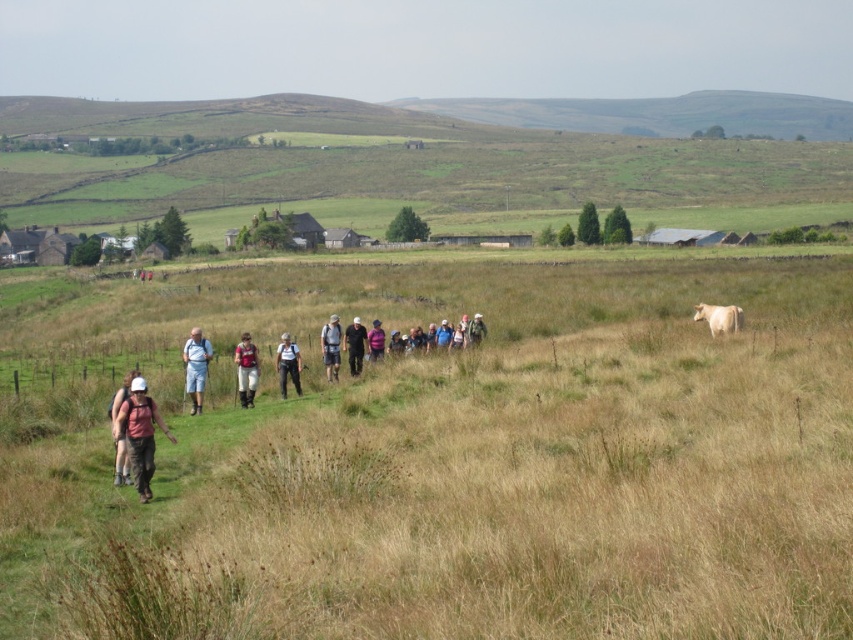
Is point (0, 560) closer to camera compared to point (346, 336)?

That is True.

Who is shorter, dry grass at center or dark gray fabric jacket at center?

dark gray fabric jacket at center is shorter.

The width and height of the screenshot is (853, 640). Identify the location of dry grass at center. (445, 456).

The image size is (853, 640). Find the location of `dry grass at center`. dry grass at center is located at coordinates (445, 456).

In the scene shown: Does dry grass at center have a larger size compared to camouflage fabric backpack at lower left?

Indeed, dry grass at center has a larger size compared to camouflage fabric backpack at lower left.

Which is behind, point (486, 493) or point (132, 432)?

The point (132, 432) is more distant.

The height and width of the screenshot is (640, 853). Find the location of `dry grass at center`. dry grass at center is located at coordinates (445, 456).

Measure the distance from camouflage fabric backpack at lower left to purple fabric jacket at center.

58.48 feet

Can you confirm if camouflage fabric backpack at lower left is bigger than purple fabric jacket at center?

Correct, camouflage fabric backpack at lower left is larger in size than purple fabric jacket at center.

What do you see at coordinates (140, 433) in the screenshot? I see `camouflage fabric backpack at lower left` at bounding box center [140, 433].

Locate an element on the screen. This screenshot has height=640, width=853. camouflage fabric backpack at lower left is located at coordinates (140, 433).